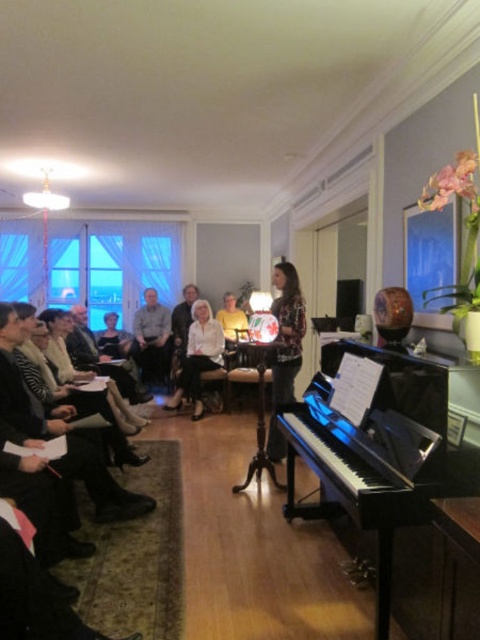
Consider the image. You are a photographer setting up for a concert photo shoot. You need to position a spotlight so that it illuminates the black polished piano at lower right and the matte white blouse at center without casting harsh shadows. Given their spatial arrangement, which object should the spotlight be directed towards first to ensure both are properly lit?

The spotlight should first be directed towards the black polished piano at lower right since it is in front of the matte white blouse at center, allowing the light to naturally spill onto both objects while minimizing harsh shadows.

You are a photographer standing in the center of the room. You want to take a photo of the black polished piano at lower right and the light brown fabric shirt at center. Which object will appear larger in the photo?

The black polished piano at lower right will appear larger in the photo because it is closer to the photographer than the light brown fabric shirt at center.

You are standing at the entrance of the room and want to move towards the black polished piano at lower right. According to the coordinates provided, in which direction should you move from your current position?

The black polished piano at lower right is located at coordinates point (376, 449), so you should move towards the lower right direction from your current position at the entrance.